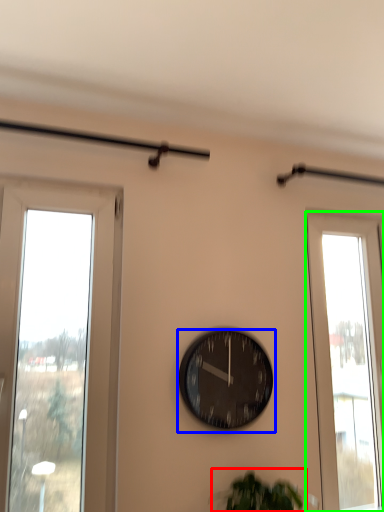
Question: Based on their relative distances, which object is nearer to plant (highlighted by a red box)? Choose from wall clock (highlighted by a blue box) and window (highlighted by a green box).

Choices:
 (A) wall clock
 (B) window

Answer: (A)